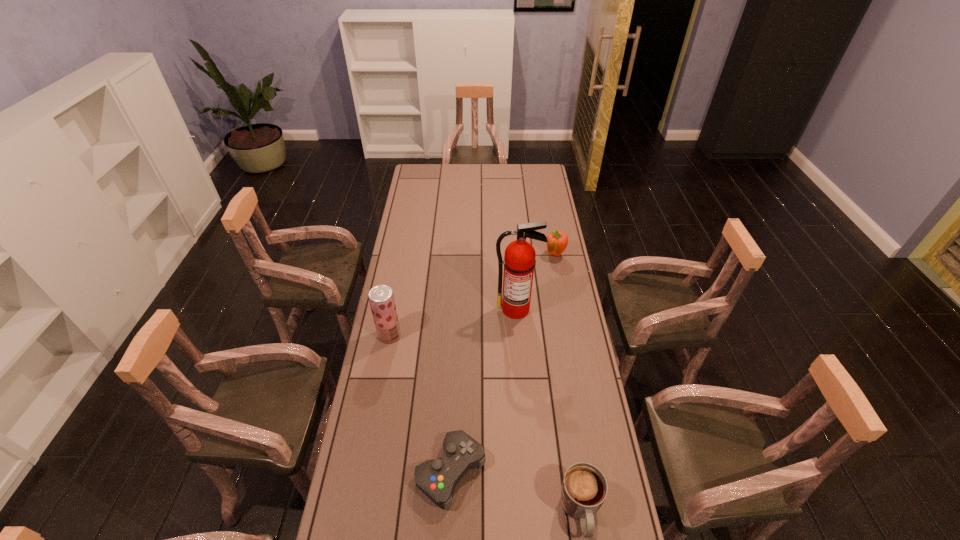
Locate an element on the screen. Image resolution: width=960 pixels, height=540 pixels. fire extinguisher is located at coordinates (519, 261).

Locate an element on the screen. The image size is (960, 540). the fourth nearest object is located at coordinates (519, 261).

What are the coordinates of `the third farthest object` in the screenshot? It's located at (381, 298).

The image size is (960, 540). Find the location of `the fourth shortest object`. the fourth shortest object is located at coordinates tap(381, 298).

Find the location of a particular element. The height and width of the screenshot is (540, 960). pepper is located at coordinates (557, 241).

You are a GUI agent. You are given a task and a screenshot of the screen. Output one action in this format:
    pyautogui.click(x=<x>, y=<y>)
    Task: Click on the farthest object
    The height and width of the screenshot is (540, 960).
    Given the screenshot: What is the action you would take?
    pyautogui.click(x=557, y=241)

At what (x,y) coordinates should I click in order to perform the action: click on control. Please return your answer as a coordinate pair (x, y). Looking at the image, I should click on (437, 478).

Locate an element on the screen. The height and width of the screenshot is (540, 960). the shortest object is located at coordinates (437, 478).

In order to click on free space located on the side of the fourth nearest object near the handle in this screenshot , I will do `click(517, 329)`.

The width and height of the screenshot is (960, 540). I want to click on free region located on the back of the fruit juice, so click(x=400, y=275).